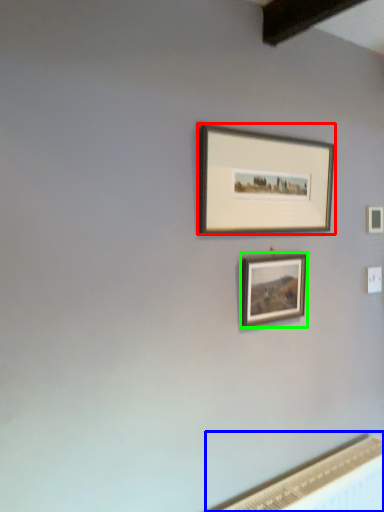
Question: Which object is positioned farthest from picture frame (highlighted by a red box)? Select from radiator (highlighted by a blue box) and picture frame (highlighted by a green box).

Choices:
 (A) radiator
 (B) picture frame

Answer: (A)